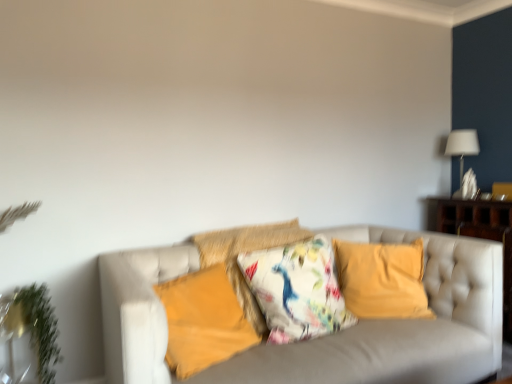
Question: Is green leafy plant at left not near white fabric lampshade at upper right?

Choices:
 (A) yes
 (B) no

Answer: (A)

Question: From the image's perspective, is green leafy plant at left located above white fabric lampshade at upper right?

Choices:
 (A) yes
 (B) no

Answer: (B)

Question: Is white fabric lampshade at upper right located within green leafy plant at left?

Choices:
 (A) no
 (B) yes

Answer: (A)

Question: From the image's perspective, is green leafy plant at left located beneath white fabric lampshade at upper right?

Choices:
 (A) yes
 (B) no

Answer: (A)

Question: Considering the relative sizes of green leafy plant at left and white fabric lampshade at upper right in the image provided, is green leafy plant at left taller than white fabric lampshade at upper right?

Choices:
 (A) yes
 (B) no

Answer: (A)

Question: From a real-world perspective, is matte yellow pillow at center, which ranks as the fourth pillow in right-to-left order, positioned above or below green leafy plant at left?

Choices:
 (A) above
 (B) below

Answer: (A)

Question: Is matte yellow pillow at center, positioned as the 1th pillow in left-to-right order, bigger or smaller than green leafy plant at left?

Choices:
 (A) big
 (B) small

Answer: (A)

Question: Visually, is matte yellow pillow at center, which ranks as the fourth pillow in right-to-left order, positioned to the left or to the right of green leafy plant at left?

Choices:
 (A) left
 (B) right

Answer: (B)

Question: From the image's perspective, is matte yellow pillow at center, positioned as the 1th pillow in left-to-right order, above or below green leafy plant at left?

Choices:
 (A) below
 (B) above

Answer: (B)

Question: In terms of size, does matte yellow pillow at center, positioned as the 1th pillow in left-to-right order, appear bigger or smaller than velvet yellow pillow at center, acting as the fourth pillow starting from the left?

Choices:
 (A) small
 (B) big

Answer: (A)

Question: In terms of width, does matte yellow pillow at center, which ranks as the fourth pillow in right-to-left order, look wider or thinner when compared to velvet yellow pillow at center, acting as the 1th pillow starting from the right?

Choices:
 (A) thin
 (B) wide

Answer: (B)

Question: Which is correct: matte yellow pillow at center, positioned as the 1th pillow in left-to-right order, is inside velvet yellow pillow at center, acting as the 1th pillow starting from the right, or outside of it?

Choices:
 (A) outside
 (B) inside

Answer: (A)

Question: From their relative heights in the image, would you say matte yellow pillow at center, which ranks as the fourth pillow in right-to-left order, is taller or shorter than velvet yellow pillow at center, acting as the 1th pillow starting from the right?

Choices:
 (A) short
 (B) tall

Answer: (A)

Question: From a real-world perspective, is matte yellow pillow at center, positioned as the 1th pillow in left-to-right order, physically located above or below floral fabric cushion at center, acting as the 2th pillow starting from the right?

Choices:
 (A) above
 (B) below

Answer: (B)

Question: Relative to floral fabric cushion at center, acting as the 2th pillow starting from the right, is matte yellow pillow at center, which ranks as the fourth pillow in right-to-left order, in front or behind?

Choices:
 (A) front
 (B) behind

Answer: (A)